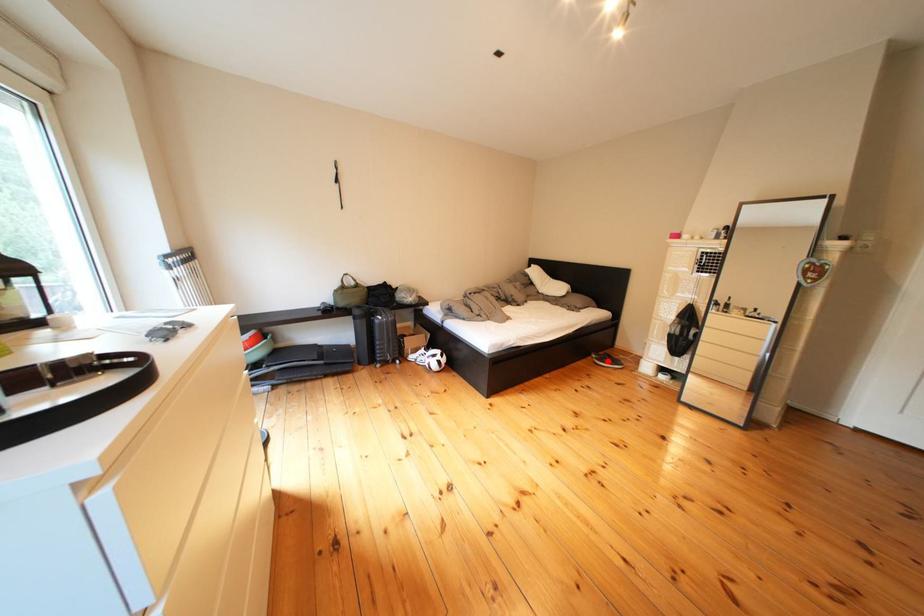
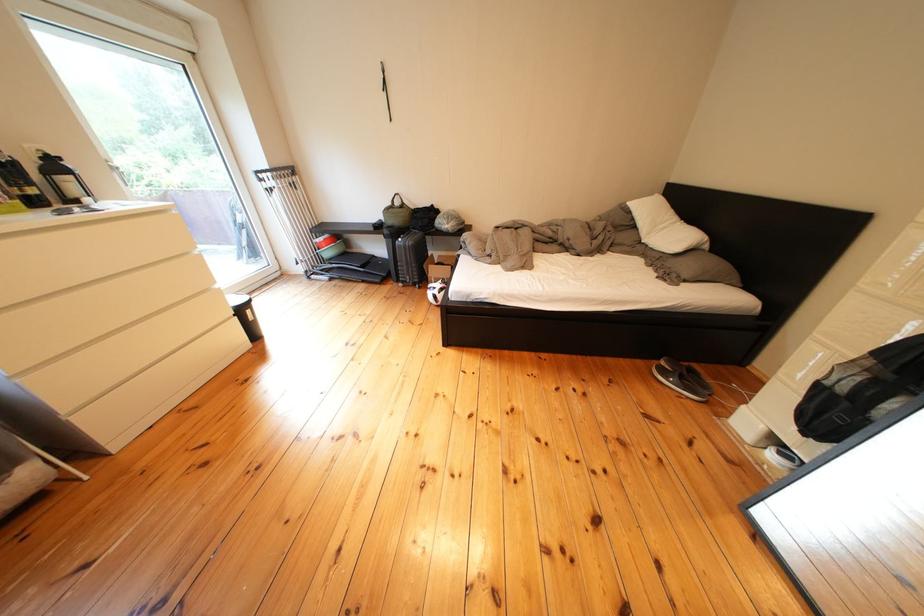
The point at the highlighted location is marked in the first image. Where is the corresponding point in the second image?

(676, 368)